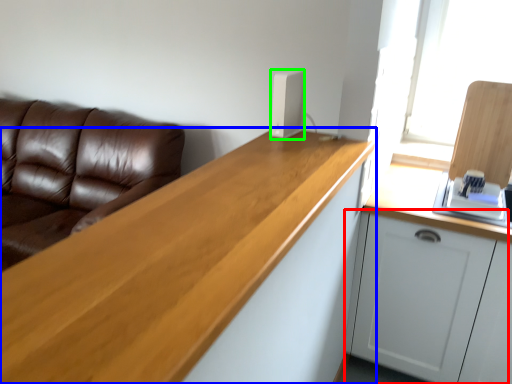
Question: Which is nearer to the cabinetry (highlighted by a red box)? countertop (highlighted by a blue box) or appliance (highlighted by a green box).

Choices:
 (A) countertop
 (B) appliance

Answer: (A)